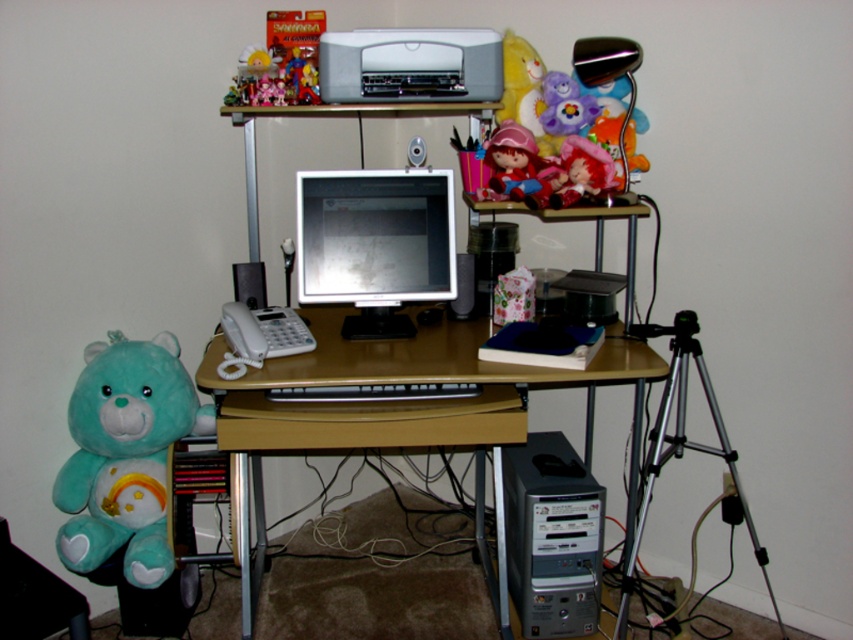
Question: Can you confirm if silver metallic tripod at lower right is positioned to the left of black plastic speaker at left?

Choices:
 (A) yes
 (B) no

Answer: (B)

Question: Which object appears closest to the camera in this image?

Choices:
 (A) silver metallic desktop tower at lower center
 (B) matte plastic doll at center
 (C) brown wood desk at center

Answer: (C)

Question: Considering the real-world distances, which object is farthest from the silver metallic desktop tower at lower center?

Choices:
 (A) black plastic speaker at center
 (B) black plastic speaker at left
 (C) silver metallic tripod at lower right

Answer: (B)

Question: In this image, where is silver metallic tripod at lower right located relative to matte plastic doll at center?

Choices:
 (A) left
 (B) right

Answer: (B)

Question: Among these objects, which one is nearest to the camera?

Choices:
 (A) black plastic speaker at center
 (B) silver metallic tripod at lower right

Answer: (B)

Question: Can you confirm if brown wood desk at center is thinner than black plastic speaker at center?

Choices:
 (A) no
 (B) yes

Answer: (A)